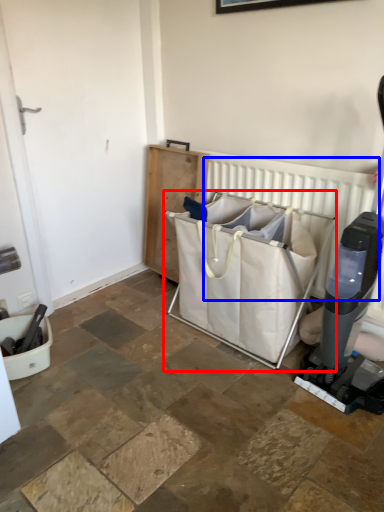
Question: Which point is further to the camera, baby carriage (highlighted by a red box) or radiator (highlighted by a blue box)?

Choices:
 (A) baby carriage
 (B) radiator

Answer: (B)